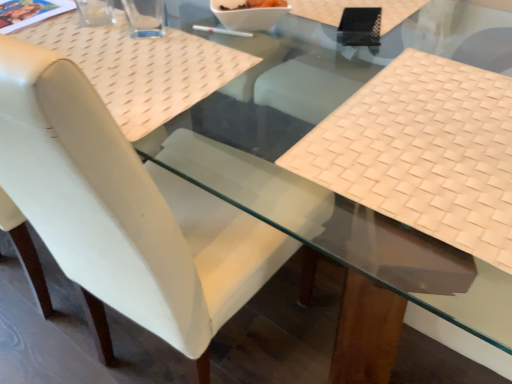
Question: Would you say beige woven mat at right contains transparent glass cup at upper left, marked as the 1th clear in a left-to-right arrangement?

Choices:
 (A) no
 (B) yes

Answer: (A)

Question: From a real-world perspective, is beige woven mat at right below transparent glass cup at upper left, marked as the 1th clear in a left-to-right arrangement?

Choices:
 (A) no
 (B) yes

Answer: (B)

Question: Is beige woven mat at right in contact with transparent glass cup at upper left, the second clear positioned from the right?

Choices:
 (A) yes
 (B) no

Answer: (B)

Question: Can you confirm if beige woven mat at right is positioned to the right of transparent glass cup at upper left, marked as the 1th clear in a left-to-right arrangement?

Choices:
 (A) no
 (B) yes

Answer: (B)

Question: Is beige woven mat at right looking in the opposite direction of transparent glass cup at upper left, the second clear positioned from the right?

Choices:
 (A) yes
 (B) no

Answer: (B)

Question: From the image's perspective, is transparent glass at upper left, the 2th clear when ordered from left to right, above or below white glossy bowl at center?

Choices:
 (A) above
 (B) below

Answer: (B)

Question: Is transparent glass at upper left, the 2th clear when ordered from left to right, wider or thinner than white glossy bowl at center?

Choices:
 (A) wide
 (B) thin

Answer: (B)

Question: From their relative heights in the image, would you say transparent glass at upper left, the 2th clear when ordered from left to right, is taller or shorter than white glossy bowl at center?

Choices:
 (A) tall
 (B) short

Answer: (A)

Question: Choose the correct answer: Is transparent glass at upper left, the first clear when ordered from right to left, inside white glossy bowl at center or outside it?

Choices:
 (A) inside
 (B) outside

Answer: (B)

Question: From the image's perspective, is transparent glass at upper left, the 2th clear when ordered from left to right, positioned above or below white leather chair at center?

Choices:
 (A) below
 (B) above

Answer: (B)

Question: Looking at the image, does transparent glass at upper left, the first clear when ordered from right to left, seem bigger or smaller compared to white leather chair at center?

Choices:
 (A) big
 (B) small

Answer: (B)

Question: Looking at their shapes, would you say transparent glass at upper left, the first clear when ordered from right to left, is wider or thinner than white leather chair at center?

Choices:
 (A) wide
 (B) thin

Answer: (B)

Question: From a real-world perspective, is transparent glass at upper left, the 2th clear when ordered from left to right, physically located above or below white leather chair at center?

Choices:
 (A) below
 (B) above

Answer: (B)

Question: Is transparent glass cup at upper left, marked as the 1th clear in a left-to-right arrangement, situated inside transparent glass at upper left, the first clear when ordered from right to left, or outside?

Choices:
 (A) outside
 (B) inside

Answer: (A)

Question: From the image's perspective, is transparent glass cup at upper left, marked as the 1th clear in a left-to-right arrangement, positioned above or below transparent glass at upper left, the 2th clear when ordered from left to right?

Choices:
 (A) above
 (B) below

Answer: (A)